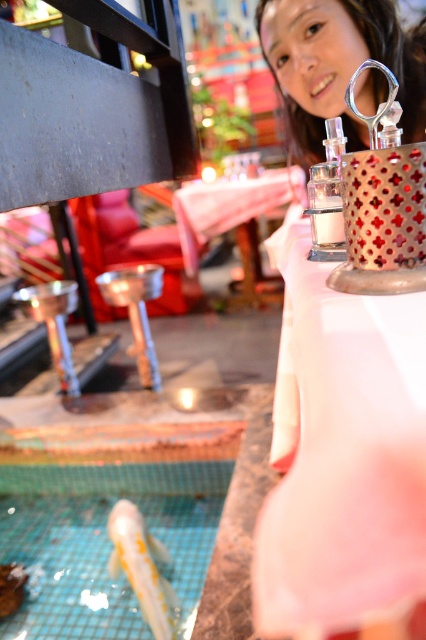
You are a customer in a store and you want to place the clear glass perfume at center on top of the metallic polished stool at center. Can you confirm if the perfume will fit on the stool?

The clear glass perfume at center is narrower than the metallic polished stool at center, so the perfume will fit on the stool.